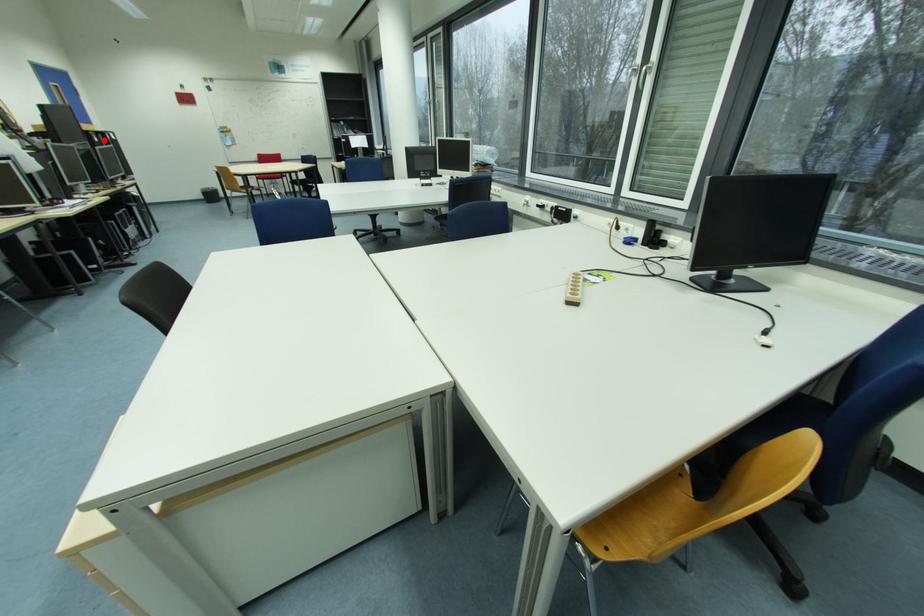
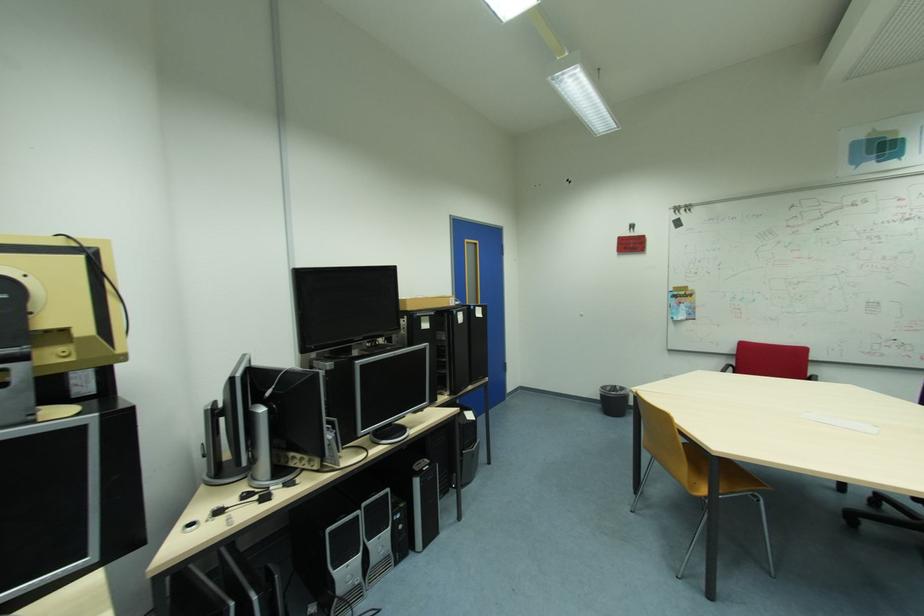
Question: I am providing you with two images of the same scene from different viewpoints. In image1, a red point is highlighted. Considering the same 3D point in image2, which of the following is correct?

Choices:
 (A) It is closer
 (B) It is farther

Answer: (A)